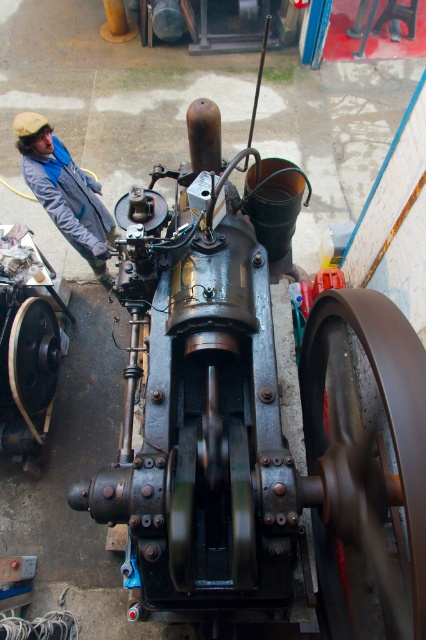
Question: From the image, what is the correct spatial relationship of brown rubber wheel at center right in relation to matte black wheel at left?

Choices:
 (A) right
 (B) left

Answer: (A)

Question: Which of the following is the closest to the observer?

Choices:
 (A) (32, 397)
 (B) (45, 176)
 (C) (403, 573)

Answer: (C)

Question: Based on their relative distances, which object is farther from the matte black wheel at left?

Choices:
 (A) brown rubber wheel at center right
 (B) gray fabric jacket at left

Answer: (A)

Question: Which is nearer to the brown rubber wheel at center right?

Choices:
 (A) gray fabric jacket at left
 (B) matte black wheel at left

Answer: (B)

Question: Where is brown rubber wheel at center right located in relation to gray fabric jacket at left in the image?

Choices:
 (A) below
 (B) above

Answer: (A)

Question: Can you confirm if brown rubber wheel at center right is positioned to the right of matte black wheel at left?

Choices:
 (A) no
 (B) yes

Answer: (B)